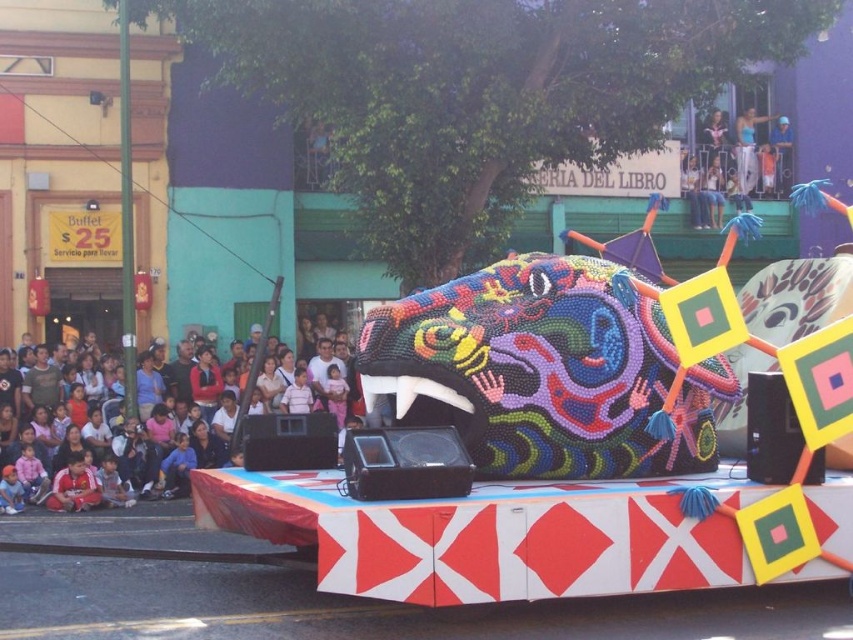
Does point (490, 314) lie in front of point (755, 157)?

Yes, point (490, 314) is closer to viewer.

Which is above, multicolored beaded sculpture at center or white fabric pants at upper right?

Positioned higher is white fabric pants at upper right.

Does point (587, 344) come farther from viewer compared to point (751, 132)?

That is False.

Where is `multicolored beaded sculpture at center`? multicolored beaded sculpture at center is located at coordinates (544, 371).

Is multicolored fabric crowd at lower left thinner than light blue jeans at upper center?

No.

Between point (187, 464) and point (701, 211), which one is positioned behind?

Point (701, 211)

Is point (144, 378) behind point (720, 182)?

No, it is in front of (720, 182).

Find the location of `multicolored fabric crowd at lower left`. multicolored fabric crowd at lower left is located at coordinates (143, 452).

Between multicolored beaded sculpture at center and blue fabric shirt at upper right, which one appears on the left side from the viewer's perspective?

multicolored beaded sculpture at center

Is point (718, 384) behind point (769, 147)?

That is False.

The image size is (853, 640). Find the location of `multicolored beaded sculpture at center`. multicolored beaded sculpture at center is located at coordinates pos(544,371).